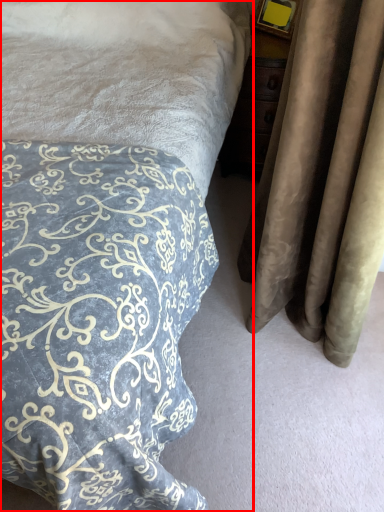
Question: In this image, where is bed (annotated by the red box) located relative to curtain?

Choices:
 (A) right
 (B) left

Answer: (B)